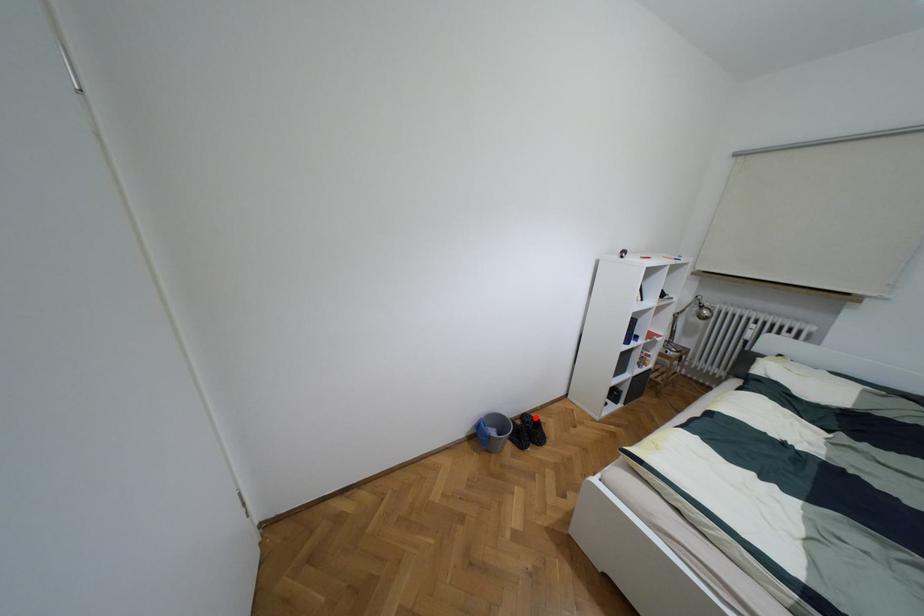
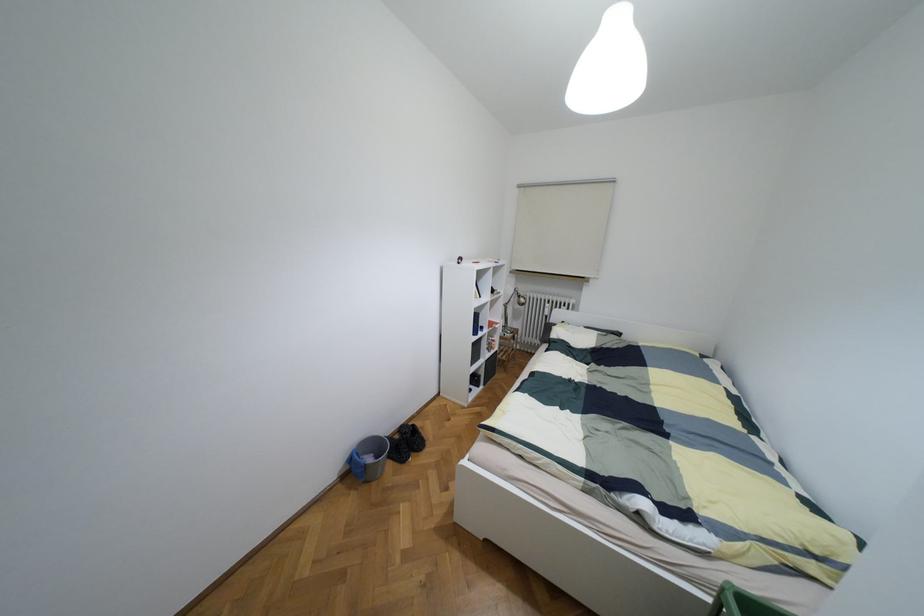
Question: I am providing you with two images of the same scene from different viewpoints. Given a red point in image1, look at the same physical point in image2. Is it:

Choices:
 (A) Closer to the viewpoint
 (B) Farther from the viewpoint

Answer: (A)